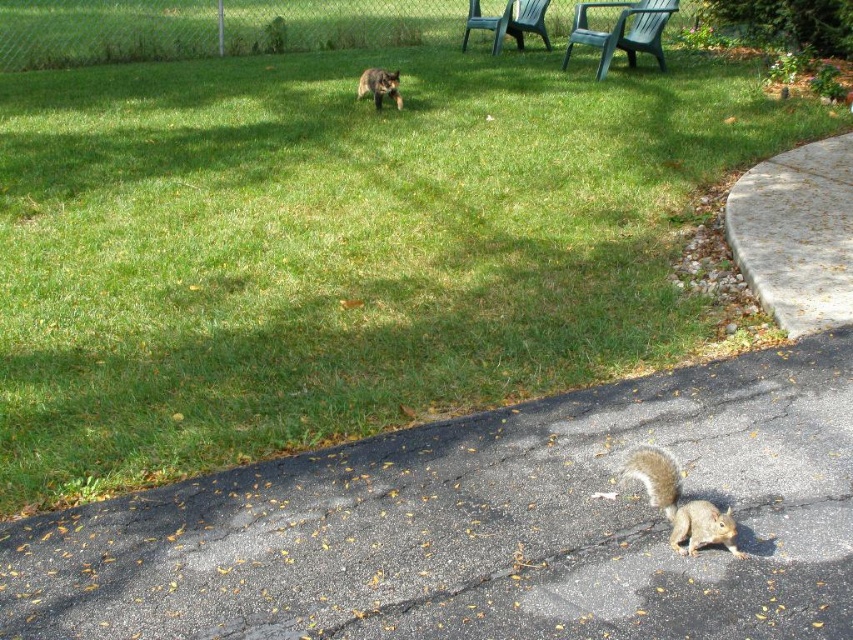
Does gray asphalt at lower right have a greater height compared to gray furry tail at lower center?

Yes, gray asphalt at lower right is taller than gray furry tail at lower center.

What do you see at coordinates (482, 525) in the screenshot?
I see `gray asphalt at lower right` at bounding box center [482, 525].

The height and width of the screenshot is (640, 853). In order to click on gray asphalt at lower right in this screenshot , I will do `click(482, 525)`.

What do you see at coordinates (679, 504) in the screenshot? I see `gray furry squirrel at lower right` at bounding box center [679, 504].

What are the coordinates of `gray furry squirrel at lower right` in the screenshot? It's located at (679, 504).

Who is lower down, gray furry squirrel at lower right or gray furry tail at lower center?

gray furry squirrel at lower right is below.

Does gray furry squirrel at lower right have a smaller size compared to gray furry tail at lower center?

Actually, gray furry squirrel at lower right might be larger than gray furry tail at lower center.

Is point (666, 516) farther from camera compared to point (664, 476)?

Yes.

This screenshot has width=853, height=640. Find the location of `gray furry squirrel at lower right`. gray furry squirrel at lower right is located at coordinates (679, 504).